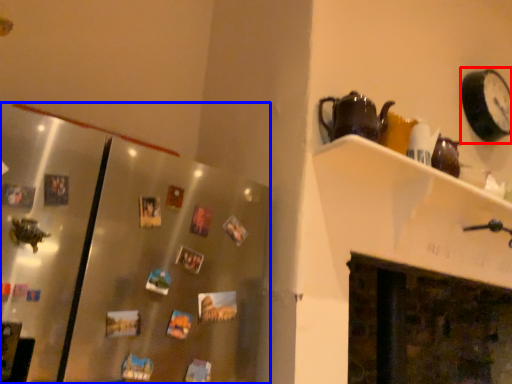
Question: Which object is further to the camera taking this photo, clock (highlighted by a red box) or glass door (highlighted by a blue box)?

Choices:
 (A) clock
 (B) glass door

Answer: (A)